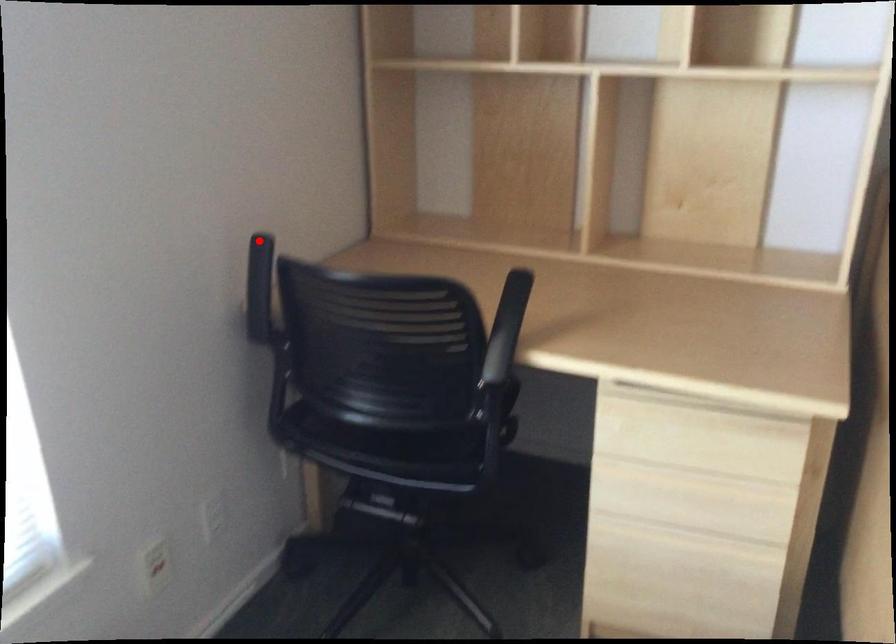
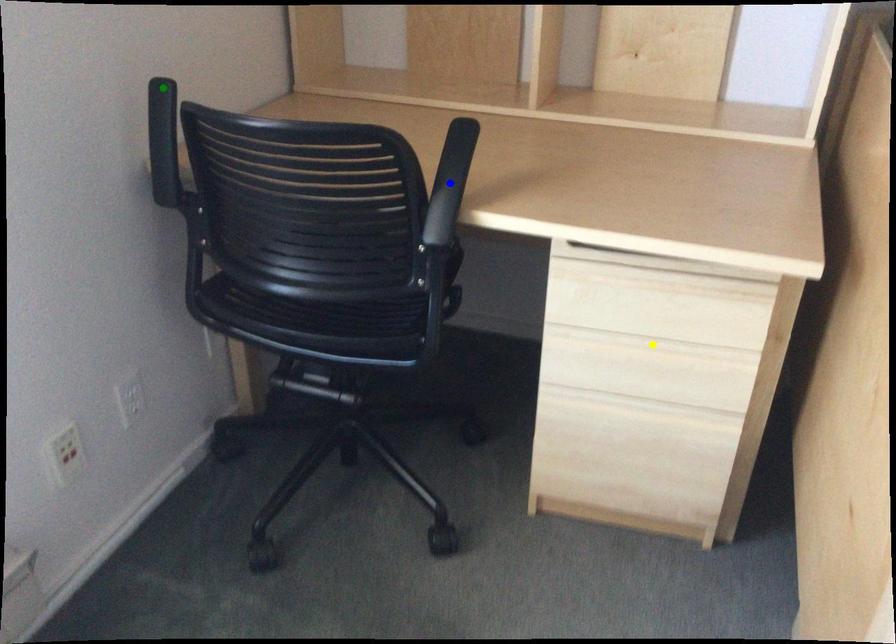
Question: I am providing you with two images of the same scene from different viewpoints. A red point is marked on the first image. You are given multiple points on the second image. Which point in image 2 represents the same 3d spot as the red point in image 1?

Choices:
 (A) blue point
 (B) yellow point
 (C) green point

Answer: (C)